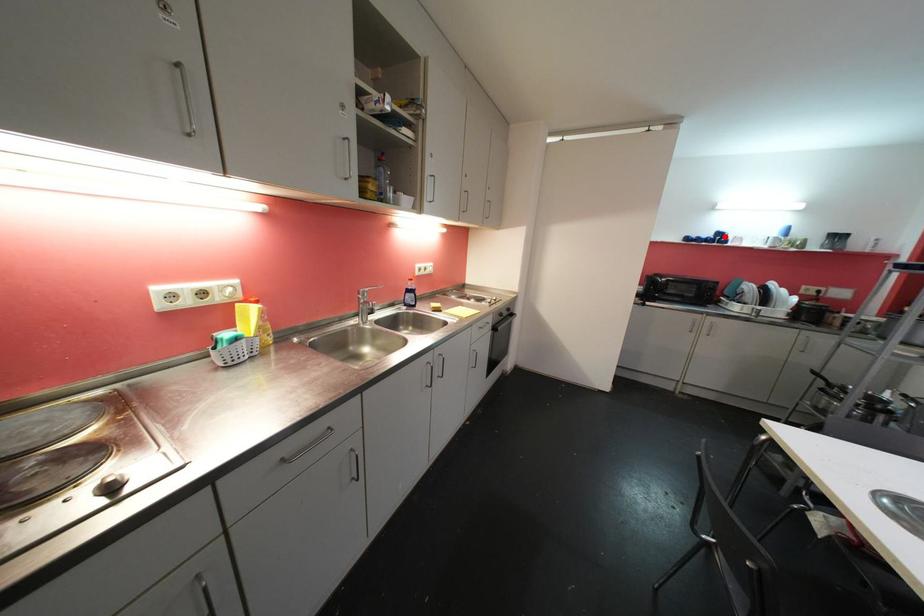
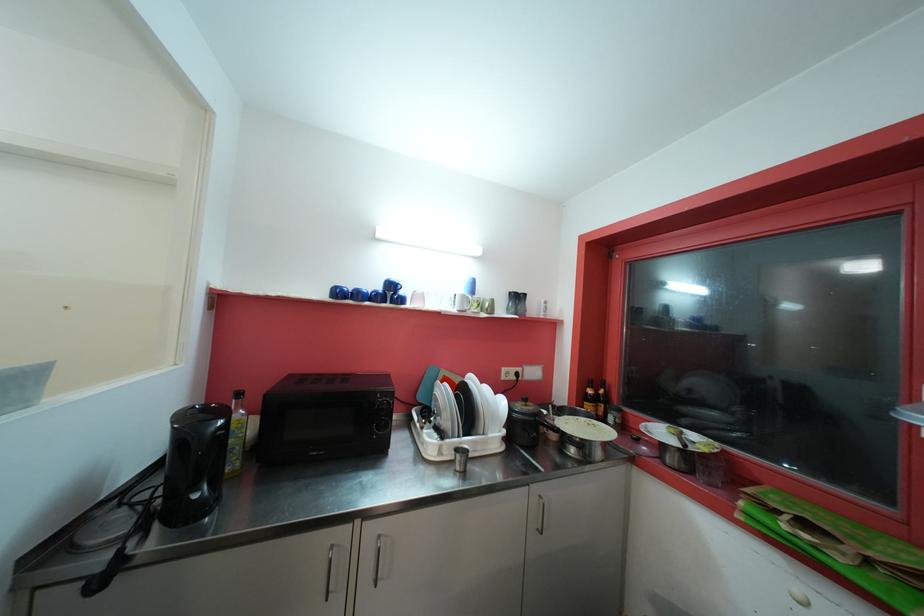
Question: I am providing you with two images of the same scene from different viewpoints. A red point is marked on the first image. Is the red point's position out of view in image 2?

Choices:
 (A) Yes
 (B) No

Answer: (B)